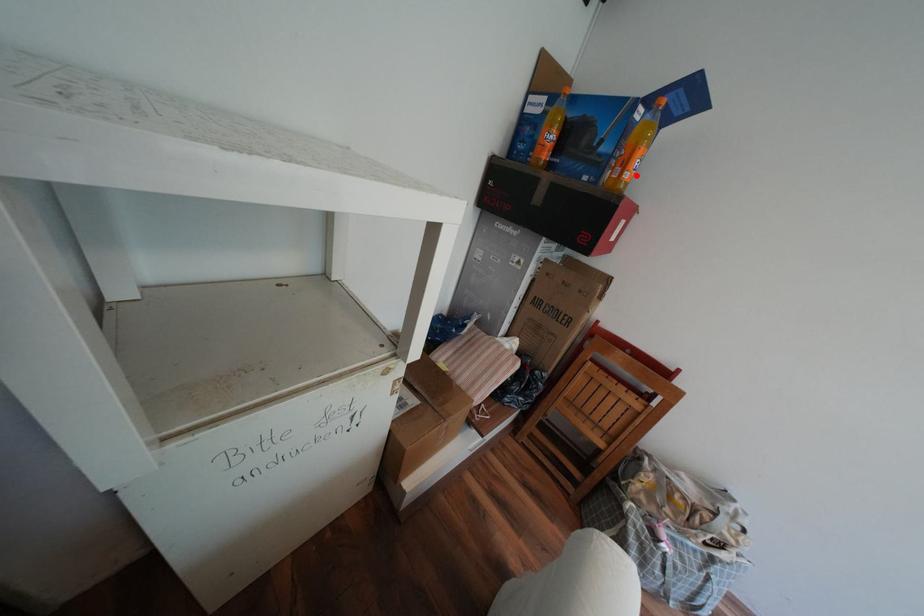
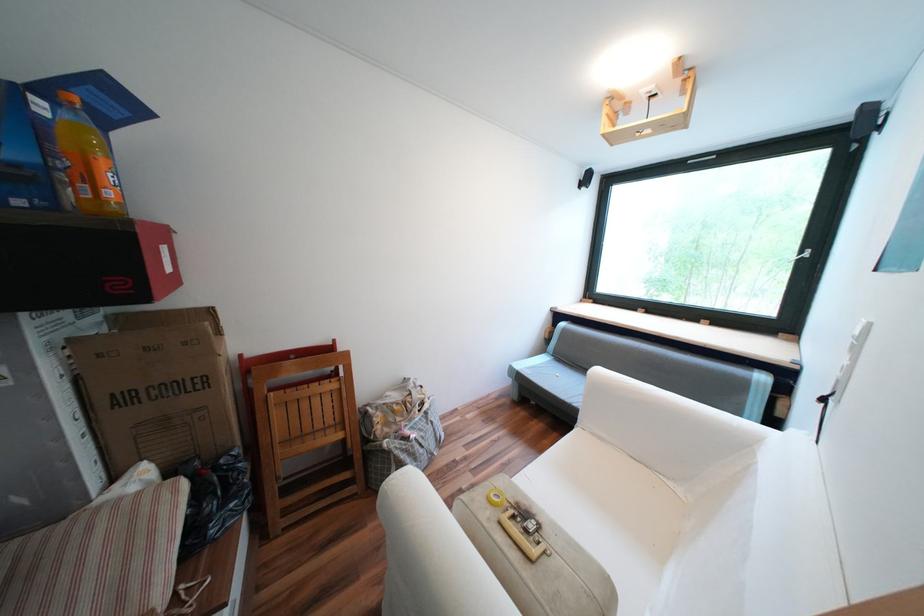
The point at the highlighted location is marked in the first image. Where is the corresponding point in the second image?

(118, 193)